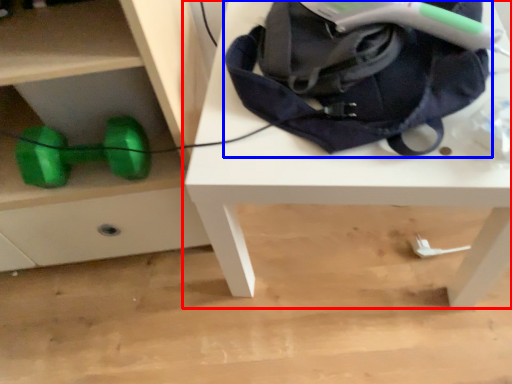
Question: Which object is further to the camera taking this photo, table (highlighted by a red box) or bag (highlighted by a blue box)?

Choices:
 (A) table
 (B) bag

Answer: (A)